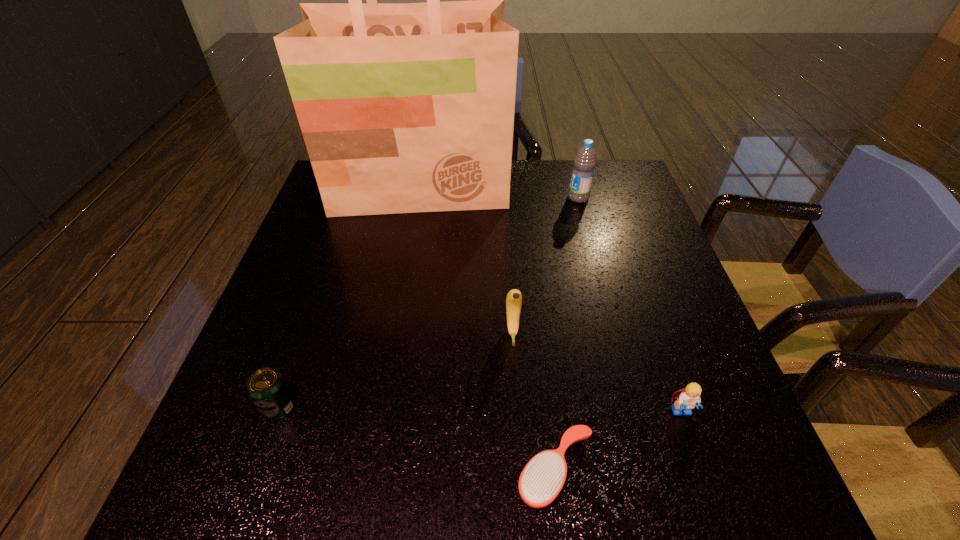
Where is `vacant space situated 0.190m on the left of the second object from right to left`? This screenshot has height=540, width=960. vacant space situated 0.190m on the left of the second object from right to left is located at coordinates (501, 198).

This screenshot has width=960, height=540. Identify the location of free space located 0.280m from the stem of the fourth nearest object. (523, 491).

This screenshot has height=540, width=960. Identify the location of blank space located 0.050m on the right of the beer can. (323, 407).

The width and height of the screenshot is (960, 540). Find the location of `vacant area situated 0.140m on the front-facing side of the Lego`. vacant area situated 0.140m on the front-facing side of the Lego is located at coordinates (715, 509).

Where is `free location located 0.230m on the right of the nearest object`? free location located 0.230m on the right of the nearest object is located at coordinates (735, 470).

At what (x,y) coordinates should I click in order to perform the action: click on grocery bag at the far edge. Please return your answer as a coordinate pair (x, y). This screenshot has height=540, width=960. Looking at the image, I should click on coord(404,108).

The width and height of the screenshot is (960, 540). Identify the location of water bottle situated at the far edge. (584, 162).

Where is `object that is at the near edge`? Image resolution: width=960 pixels, height=540 pixels. object that is at the near edge is located at coordinates (542, 479).

The height and width of the screenshot is (540, 960). I want to click on grocery bag positioned at the left edge, so click(404, 108).

Where is `beer can situated at the left edge`? The image size is (960, 540). beer can situated at the left edge is located at coordinates (267, 388).